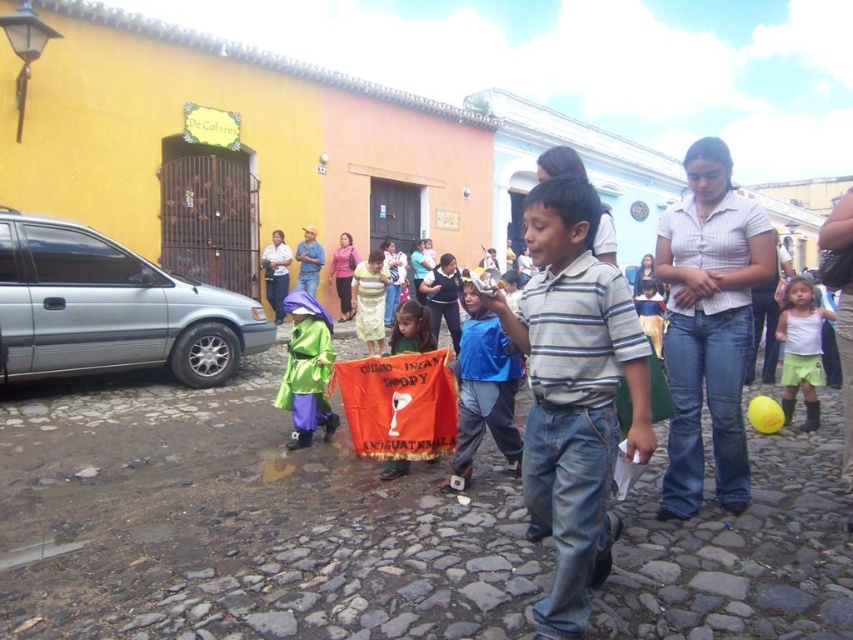
Question: Considering the real-world distances, which object is farthest from the white matte shirt at center?

Choices:
 (A) blue cotton shirt at center
 (B) striped cotton shirt at center

Answer: (B)

Question: Among these points, which one is farthest from the camera?

Choices:
 (A) (585, 317)
 (B) (802, 337)
 (C) (508, 433)

Answer: (B)

Question: Does striped cotton shirt at center have a larger size compared to blue cotton shirt at center?

Choices:
 (A) no
 (B) yes

Answer: (A)

Question: Which of these objects is positioned farthest from the white matte shirt at center?

Choices:
 (A) striped cotton shirt at center
 (B) blue cotton shirt at center

Answer: (A)

Question: Is striped cotton shirt at center further to camera compared to blue cotton shirt at center?

Choices:
 (A) no
 (B) yes

Answer: (A)

Question: From the image, what is the correct spatial relationship of striped cotton shirt at center in relation to white matte shirt at center?

Choices:
 (A) above
 (B) below

Answer: (A)